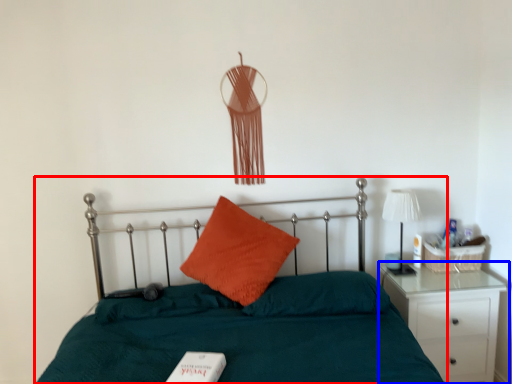
Question: Which of the following is the closest to the observer, bed (highlighted by a red box) or nightstand (highlighted by a blue box)?

Choices:
 (A) bed
 (B) nightstand

Answer: (A)